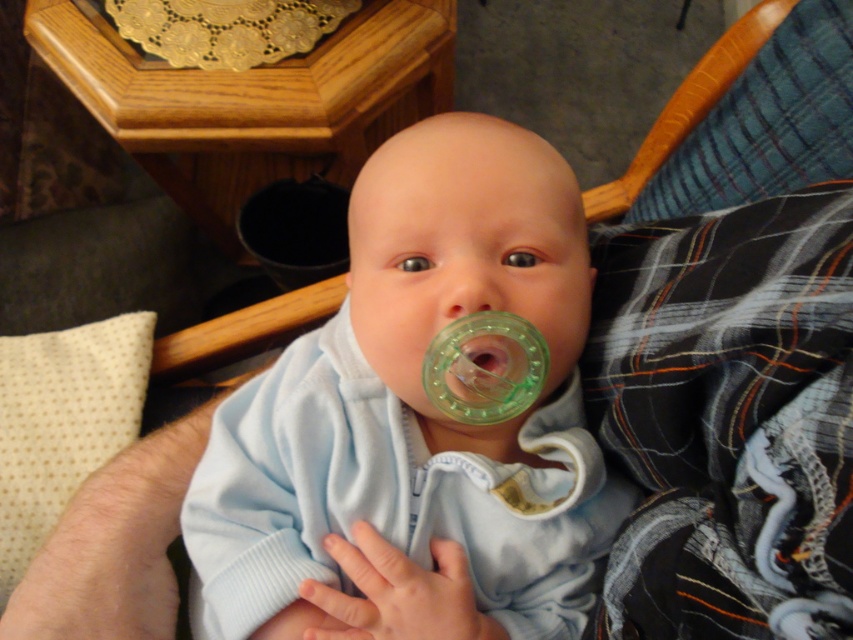
From the picture: The baby is positioned at a specific coordinate in the image. If you were to draw a vertical line through the center of the image, would the light blue fabric baby at center be to the left or right of this line?

The light blue fabric baby at center is located at point (x=415, y=422), which means it is to the right of the vertical center line since the x coordinate is greater than 0.5.

You are a photographer taking a picture of the baby. You notice two points in the image at coordinates point (546, 509) and point (473, 353). Which point is closer to the camera?

Point (473, 353) is closer to the camera because it is in front of point (546, 509).